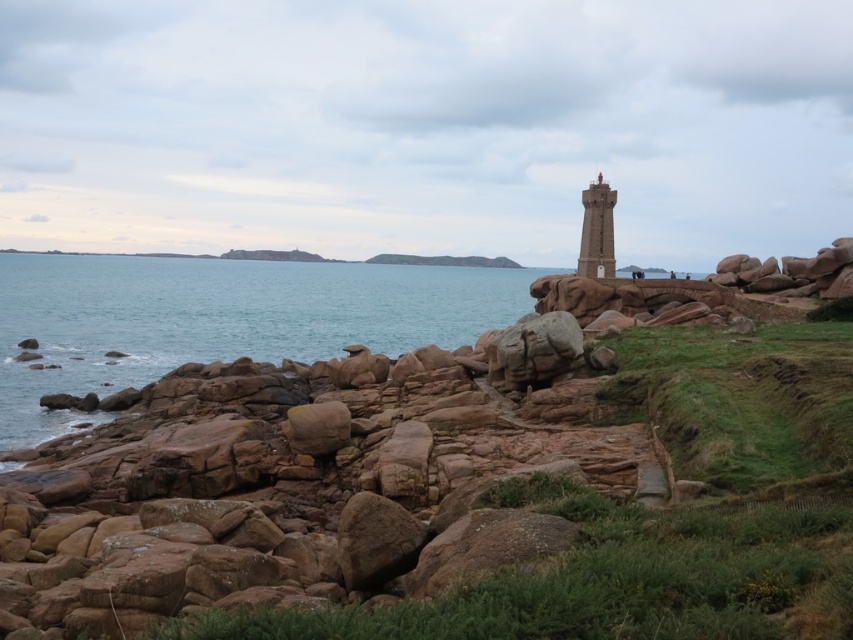
You are standing at the camera position in the coastal scene. You want to reach the blue water at lower left. Is it possible to walk directly to it without crossing any obstacles?

The blue water at lower left is 83.59 meters away from the camera. However, the scene description mentions a rugged, rocky shoreline with uneven terrain and grassy areas near the rocks, which may contain obstacles like large rocks or rough ground. Without specific information about a clear path, it is uncertain if you can walk directly to the blue water at lower left without encountering obstacles.

You are a boat captain navigating near the coast. You see the blue water at lower left and the smooth stone lighthouse at center. How far apart are these two landmarks?

The blue water at lower left is 99.57 meters from the smooth stone lighthouse at center, so the distance between them is 99.57 meters.

You are standing on the rocky shoreline and want to reach the smooth stone lighthouse at center. Which direction should you move to get closer to it without going into the blue water at lower left?

You should move away from the blue water at lower left since it is closer to you than the smooth stone lighthouse at center, so moving away from the water will bring you closer to the lighthouse.